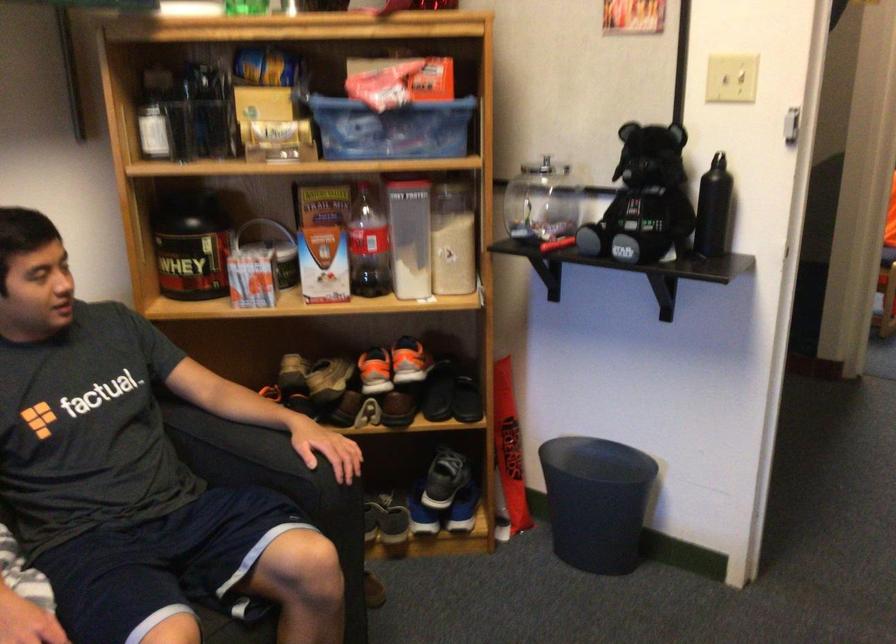
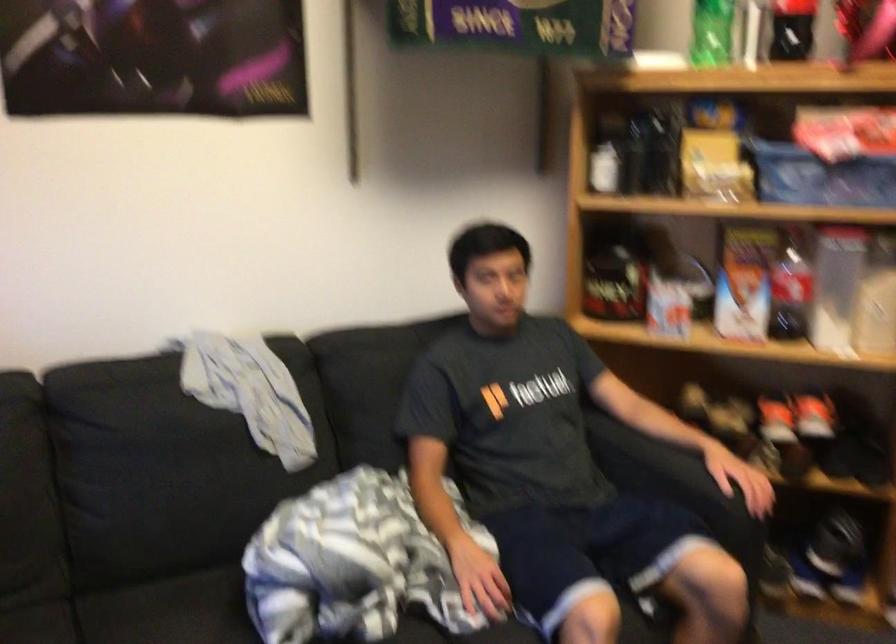
Find the pixel in the second image that matches (415,240) in the first image.

(836, 287)